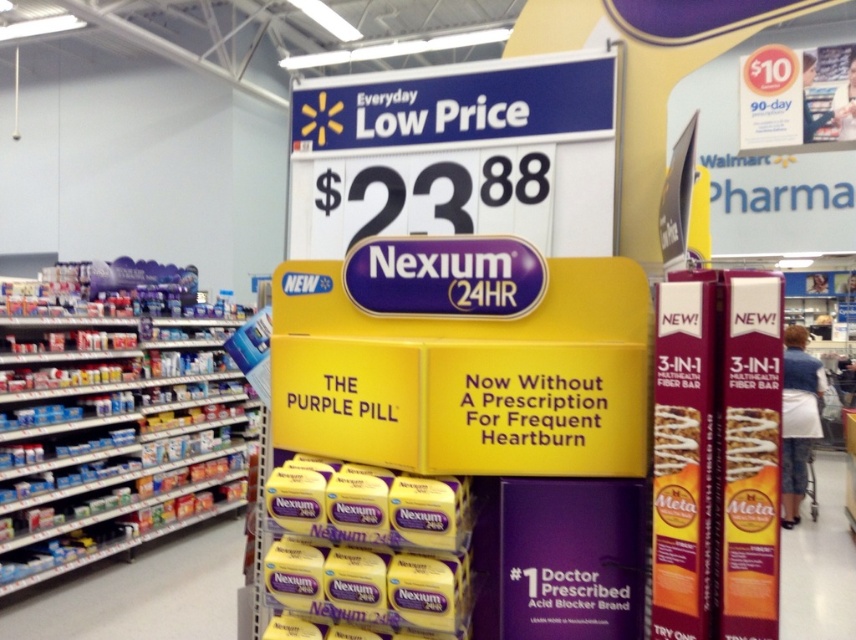
Does matte plastic shelves at left have a greater height compared to yellow matte nexium 24hr at center?

Yes, matte plastic shelves at left is taller than yellow matte nexium 24hr at center.

Is point (82, 512) farther from camera compared to point (435, 620)?

Yes, point (82, 512) is farther from viewer.

You are a GUI agent. You are given a task and a screenshot of the screen. Output one action in this format:
    pyautogui.click(x=<x>, y=<y>)
    Task: Click on the matte plastic shelves at left
    
    Given the screenshot: What is the action you would take?
    pyautogui.click(x=111, y=438)

Does matte plastic shelves at left appear on the left side of white fabric shopping cart at right?

→ Yes, matte plastic shelves at left is to the left of white fabric shopping cart at right.

Who is taller, matte plastic shelves at left or white fabric shopping cart at right?

Standing taller between the two is white fabric shopping cart at right.

You are a GUI agent. You are given a task and a screenshot of the screen. Output one action in this format:
    pyautogui.click(x=<x>, y=<y>)
    Task: Click on the matte plastic shelves at left
    This screenshot has height=640, width=856.
    Given the screenshot: What is the action you would take?
    pyautogui.click(x=111, y=438)

Can you confirm if yellow matte nexium 24hr at center is shorter than white fabric shopping cart at right?

Correct, yellow matte nexium 24hr at center is not as tall as white fabric shopping cart at right.

Is yellow matte nexium 24hr at center to the right of white fabric shopping cart at right from the viewer's perspective?

No, yellow matte nexium 24hr at center is not to the right of white fabric shopping cart at right.

Which is in front, point (327, 483) or point (805, 390)?

Point (327, 483)

This screenshot has width=856, height=640. In order to click on yellow matte nexium 24hr at center in this screenshot , I will do `click(367, 545)`.